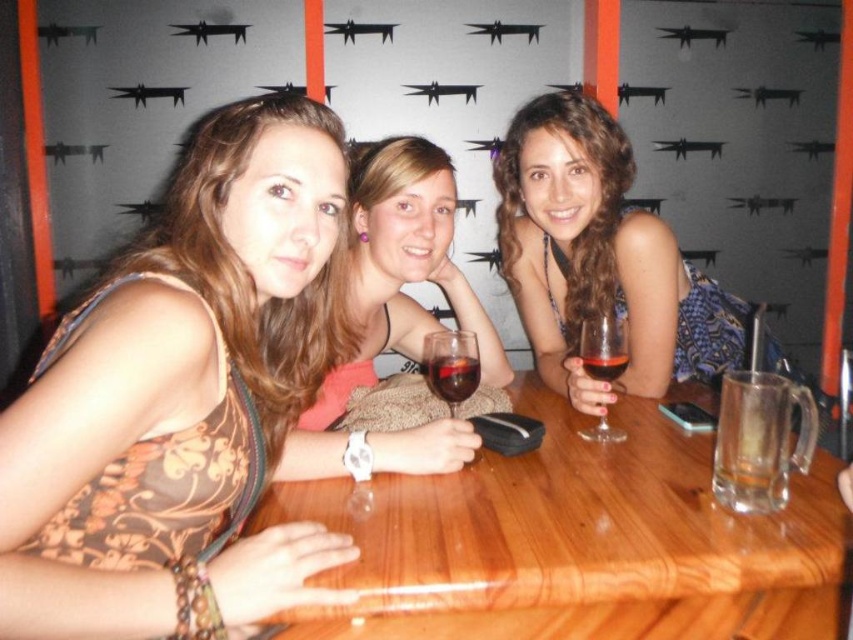
Question: Which of these objects is positioned farthest from the translucent glass at center?

Choices:
 (A) matte black dress at center
 (B) floral-patterned tank top at left
 (C) dark red glass at center
 (D) wooden table at center

Answer: (B)

Question: Among these points, which one is nearest to the camera?

Choices:
 (A) (425, 372)
 (B) (486, 560)

Answer: (B)

Question: Is wooden table at center below matte black wine glass at center?

Choices:
 (A) yes
 (B) no

Answer: (A)

Question: Which of these objects is positioned closest to the matte black wine glass at center?

Choices:
 (A) translucent glass wine glass at center
 (B) dark red glass at center
 (C) floral-patterned tank top at left
 (D) wooden table at center

Answer: (D)

Question: Where is matte black dress at center located in relation to translucent glass wine glass at center in the image?

Choices:
 (A) above
 (B) below

Answer: (A)

Question: Is translucent glass at center further to camera compared to dark red glass at center?

Choices:
 (A) yes
 (B) no

Answer: (B)